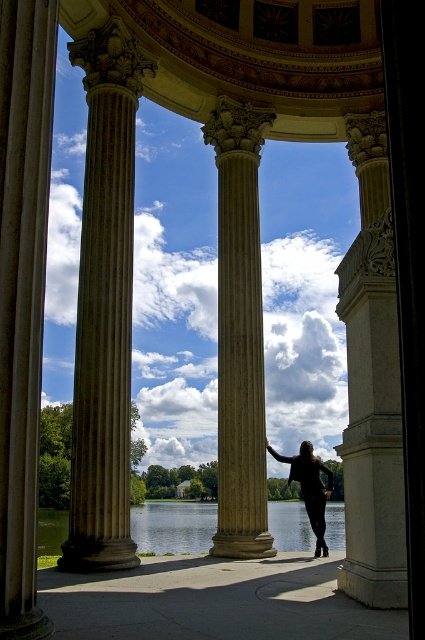
Question: Which point appears closest to the camera in this image?

Choices:
 (A) (246, 276)
 (B) (30, 337)

Answer: (B)

Question: Based on their relative distances, which object is nearer to the black matte dress at center?

Choices:
 (A) marble column at center
 (B) green water at center

Answer: (A)

Question: Which of the following is the closest to the observer?

Choices:
 (A) (x=325, y=515)
 (B) (x=231, y=340)
 (C) (x=87, y=474)

Answer: (C)

Question: Observing the image, what is the correct spatial positioning of white marble column at center in reference to green water at center?

Choices:
 (A) right
 (B) left

Answer: (A)

Question: Observing the image, what is the correct spatial positioning of polished stone column at left in reference to white marble column at center?

Choices:
 (A) right
 (B) left

Answer: (B)

Question: Does polished stone column at left lie in front of green water at center?

Choices:
 (A) no
 (B) yes

Answer: (B)